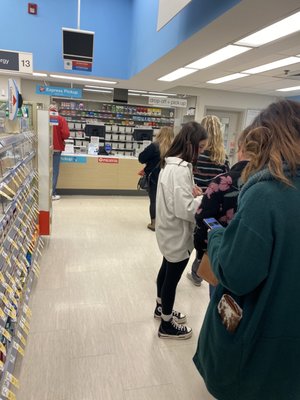
Find the location of a particular element. The width and height of the screenshot is (300, 400). floor in front of counter is located at coordinates (93, 209).